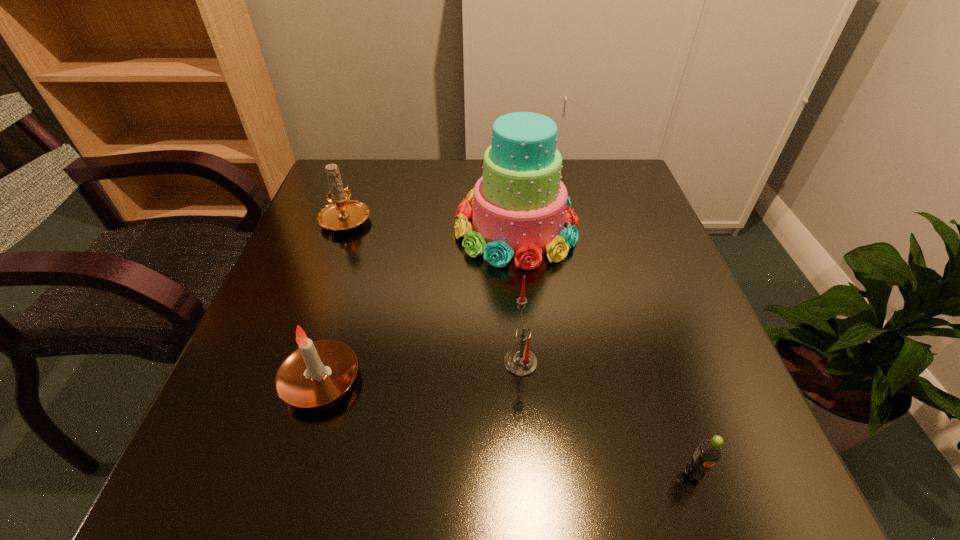
You are a GUI agent. You are given a task and a screenshot of the screen. Output one action in this format:
    pyautogui.click(x=<x>, y=<y>)
    Task: Click on the cake situated at the far edge
    
    Given the screenshot: What is the action you would take?
    pyautogui.click(x=520, y=206)

I want to click on candle that is at the far edge, so click(343, 214).

Locate an element on the screen. The image size is (960, 540). object that is positioned at the near edge is located at coordinates (709, 451).

Image resolution: width=960 pixels, height=540 pixels. What are the coordinates of `object situated at the right edge` in the screenshot? It's located at (709, 451).

Where is `object at the far left corner`? This screenshot has height=540, width=960. object at the far left corner is located at coordinates (343, 214).

At what (x,y) coordinates should I click in order to perform the action: click on object that is positioned at the near right corner. Please return your answer as a coordinate pair (x, y). Image resolution: width=960 pixels, height=540 pixels. Looking at the image, I should click on (709, 451).

Where is `vacant region at the far edge`? The height and width of the screenshot is (540, 960). vacant region at the far edge is located at coordinates (459, 173).

This screenshot has height=540, width=960. I want to click on free space at the left edge, so click(223, 389).

The image size is (960, 540). I want to click on vacant space at the right edge of the desktop, so click(701, 404).

What are the coordinates of `free space at the far left corner of the desktop` in the screenshot? It's located at (385, 162).